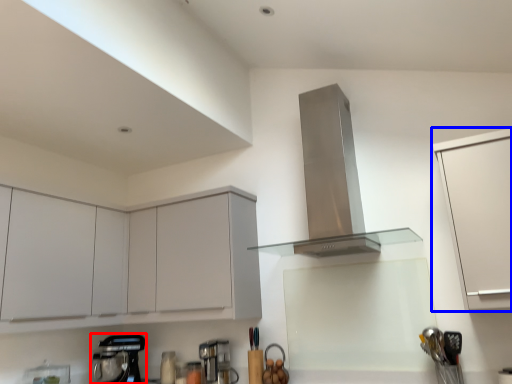
Question: Which object appears closest to the camera in this image, kitchen appliance (highlighted by a red box) or cabinetry (highlighted by a blue box)?

Choices:
 (A) kitchen appliance
 (B) cabinetry

Answer: (B)